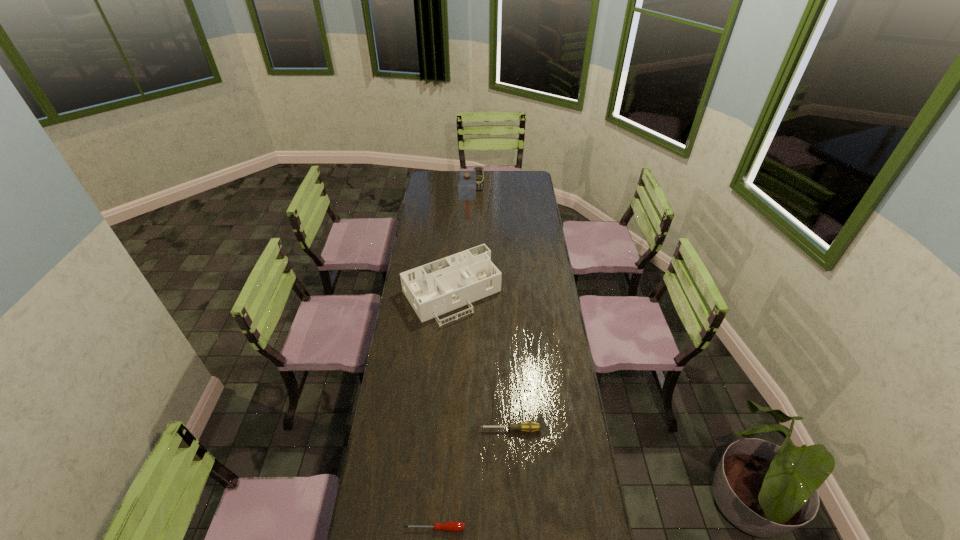
Find the location of a particular element. The width and height of the screenshot is (960, 540). blank area located 0.140m on the right of the fourth nearest object is located at coordinates (500, 220).

You are a GUI agent. You are given a task and a screenshot of the screen. Output one action in this format:
    pyautogui.click(x=<x>, y=<y>)
    Task: Click on the vacant position located 0.310m on the front face of the second tallest object
    The image size is (960, 540).
    Given the screenshot: What is the action you would take?
    pyautogui.click(x=478, y=220)

Locate an element on the screen. vacant space located on the front of the dollhouse is located at coordinates (444, 396).

Where is `free space located at the tip of the fourth farthest object`? The height and width of the screenshot is (540, 960). free space located at the tip of the fourth farthest object is located at coordinates (463, 429).

At what (x,y) coordinates should I click in order to perform the action: click on free region located 0.140m at the tip of the fourth farthest object. Please return your answer as a coordinate pair (x, y). The height and width of the screenshot is (540, 960). Looking at the image, I should click on (441, 429).

Find the location of `blank space located 0.320m at the tip of the fourth farthest object`. blank space located 0.320m at the tip of the fourth farthest object is located at coordinates (391, 429).

The image size is (960, 540). Identify the location of vacant area situated on the back of the shortest object. (443, 424).

This screenshot has width=960, height=540. I want to click on object that is at the far edge, so click(479, 171).

I want to click on dollhouse situated at the left edge, so click(x=433, y=289).

I want to click on screwdriver present at the left edge, so click(x=455, y=526).